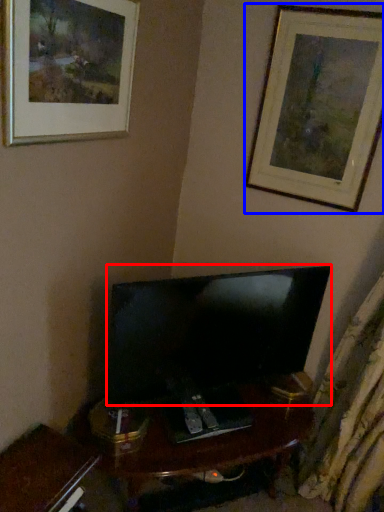
Question: Which object is further to the camera taking this photo, television (highlighted by a red box) or picture frame (highlighted by a blue box)?

Choices:
 (A) television
 (B) picture frame

Answer: (B)